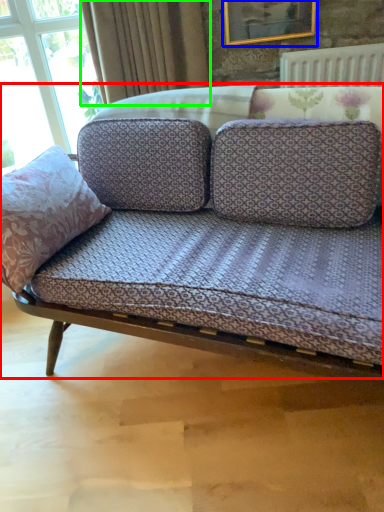
Question: Which is farther away from studio couch (highlighted by a red box)? picture frame (highlighted by a blue box) or curtain (highlighted by a green box)?

Choices:
 (A) picture frame
 (B) curtain

Answer: (A)